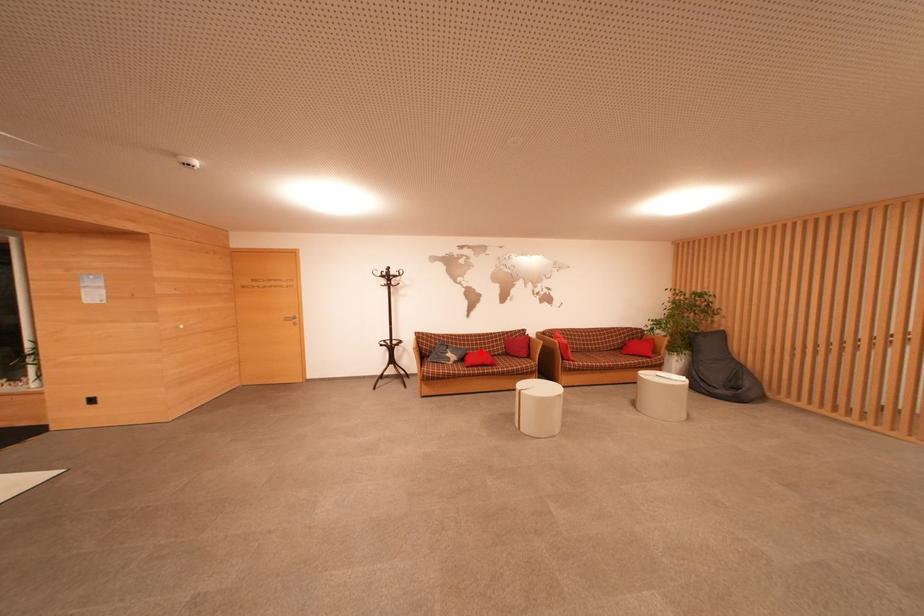
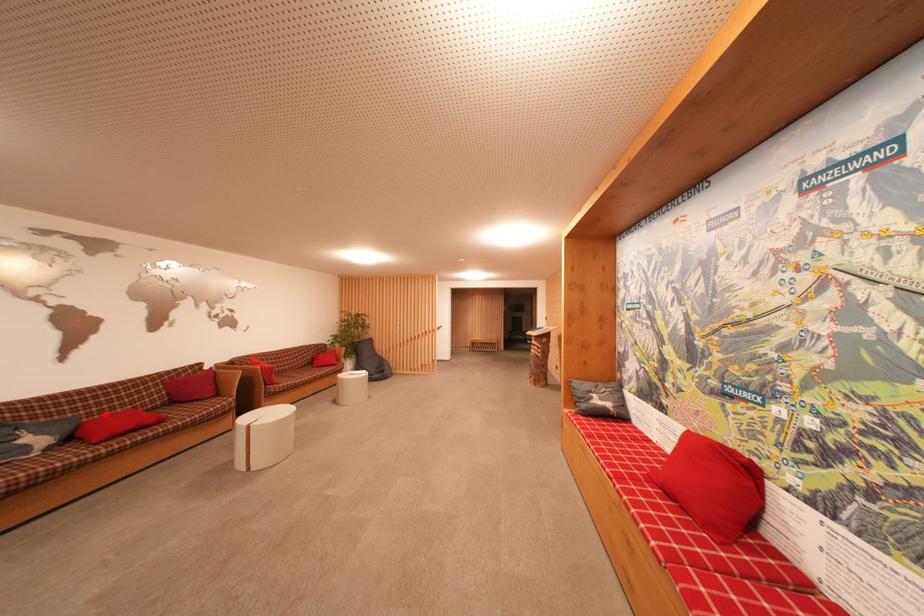
I am providing you with two images of the same scene from different viewpoints. A red point is marked on the first image and another point is marked on the second image. Do the highlighted points in image1 and image2 indicate the same real-world spot?

Yes